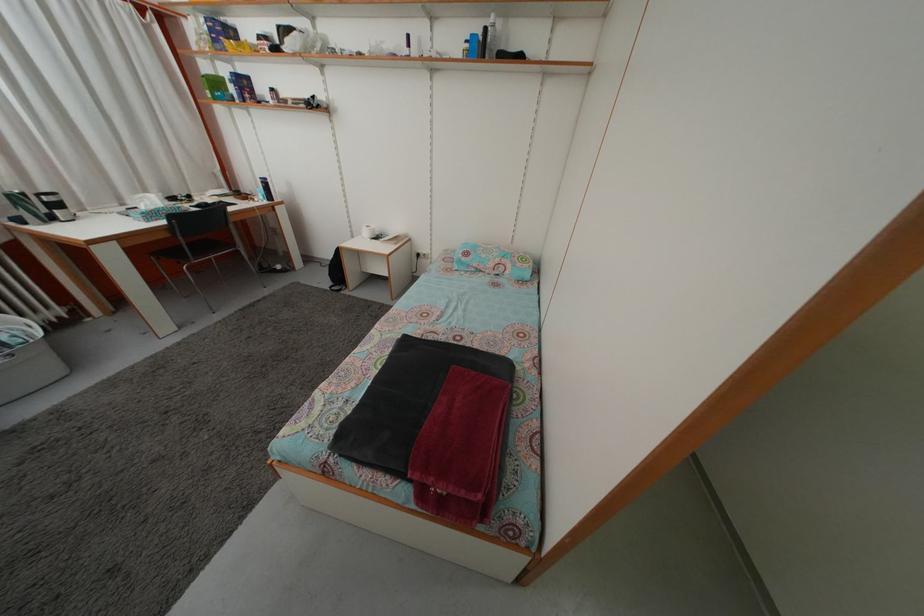
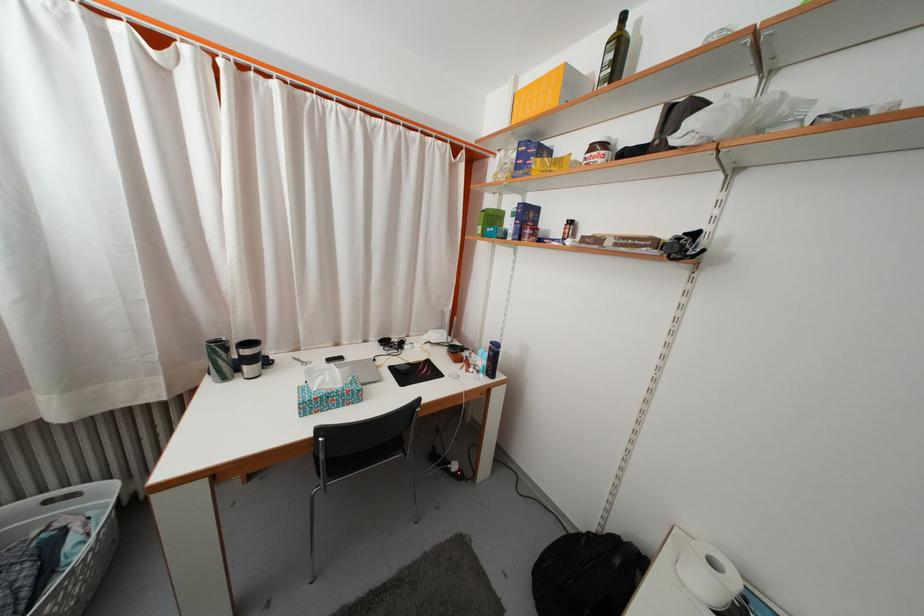
Find the pixel in the second image that matches point (223, 91) in the first image.

(500, 225)